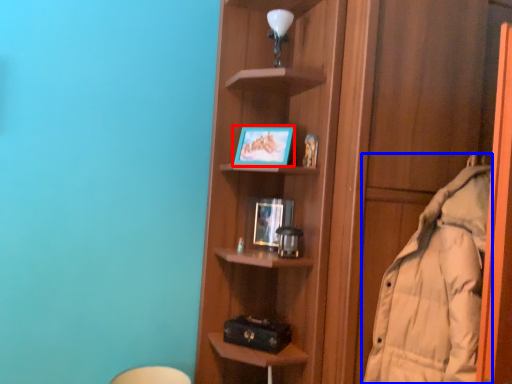
Question: Which of the following is the closest to the observer, picture frame (highlighted by a red box) or coat (highlighted by a blue box)?

Choices:
 (A) picture frame
 (B) coat

Answer: (B)